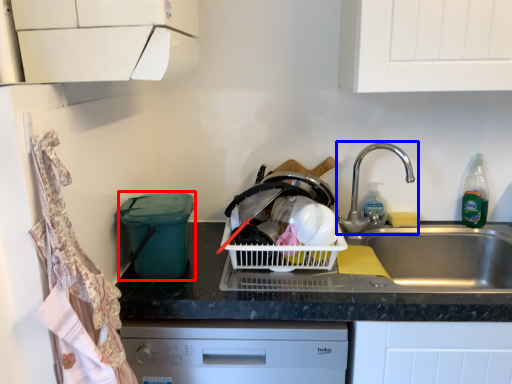
Question: Which object appears closest to the camera in this image, appliance (highlighted by a red box) or tap (highlighted by a blue box)?

Choices:
 (A) appliance
 (B) tap

Answer: (A)